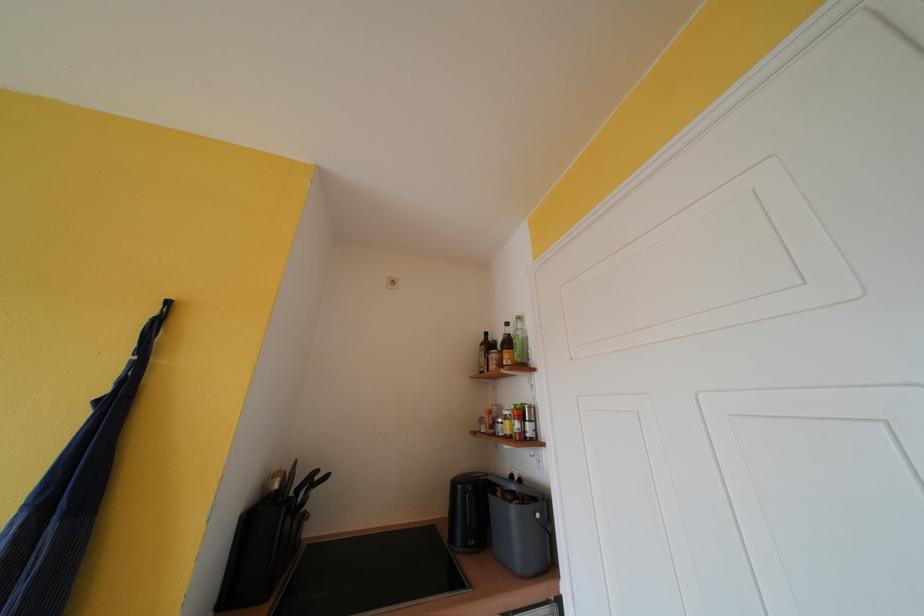
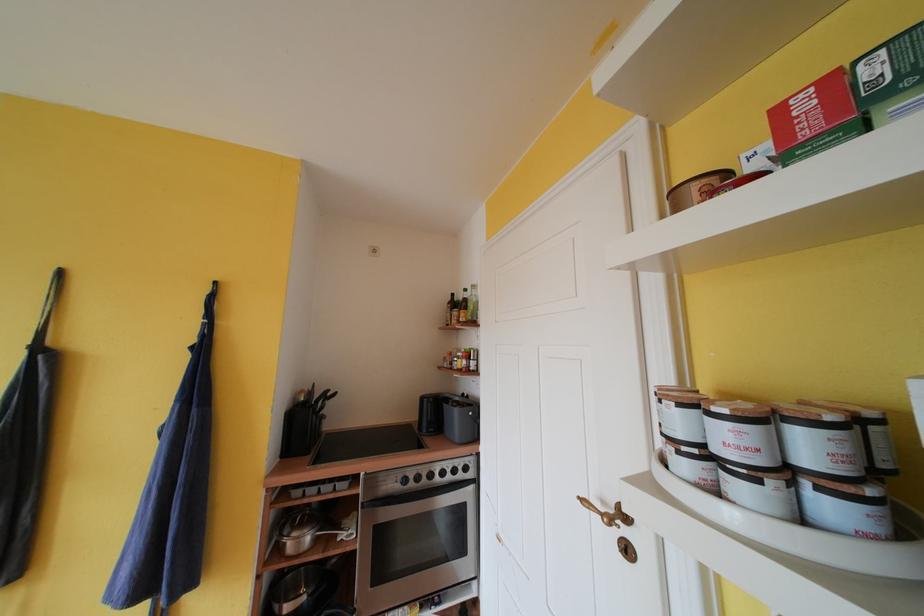
Locate, in the second image, the point that corresponds to point 295,482 in the first image.

(315, 398)